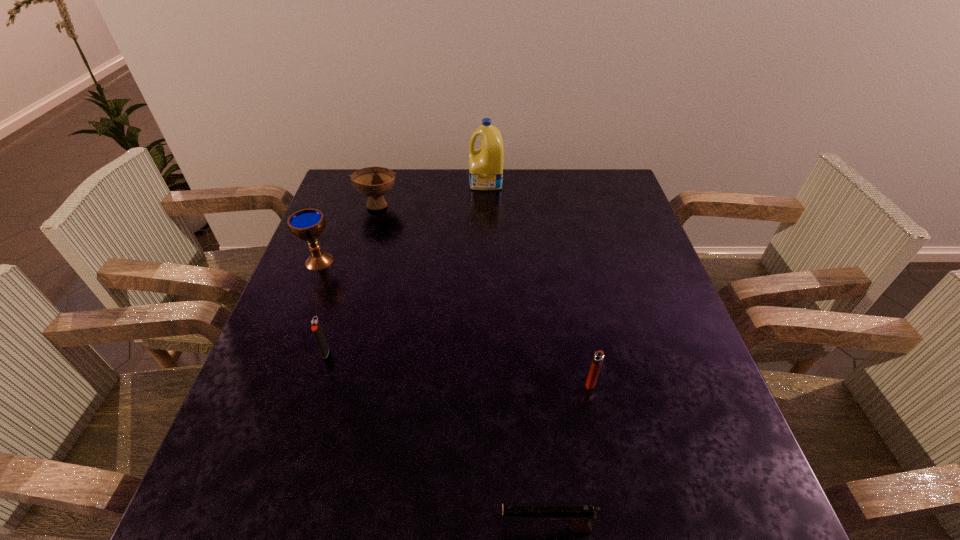
Find the location of a particular element. unoccupied position between the fourth farthest object and the detergent is located at coordinates (406, 267).

The width and height of the screenshot is (960, 540). I want to click on free spot between the fifth farthest object and the soup bowl, so click(x=485, y=293).

Find the location of a particular element. object that is the third nearest to the nearest object is located at coordinates (307, 224).

Image resolution: width=960 pixels, height=540 pixels. I want to click on object that ranks as the second closest to the nearest object, so click(x=316, y=328).

At what (x,y) coordinates should I click in order to perform the action: click on free spot that satisfies the following two spatial constraints: 1. on the back side of the chalice; 2. on the right side of the soup bowl. Please return your answer as a coordinate pair (x, y). Looking at the image, I should click on (342, 204).

The image size is (960, 540). In order to click on free space that satisfies the following two spatial constraints: 1. on the label of the detergent; 2. on the right side of the right igniter in this screenshot , I will do `click(490, 382)`.